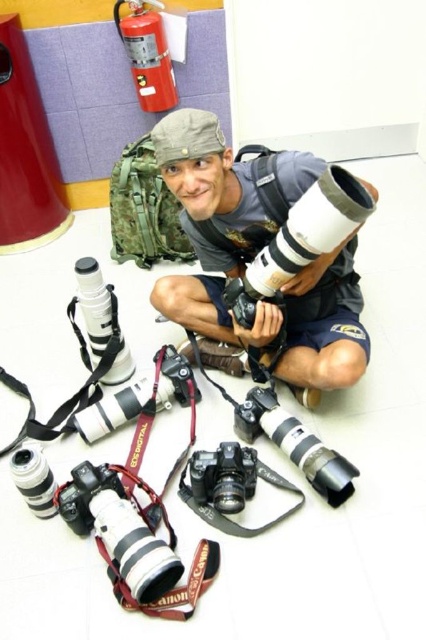
Question: Is matte black camera at center bigger than black plastic camera at center?

Choices:
 (A) no
 (B) yes

Answer: (B)

Question: Which point is farther to the camera?

Choices:
 (A) matte black camera at lower left
 (B) matte black camera at center

Answer: (B)

Question: Which point appears farthest from the camera in this image?

Choices:
 (A) (195, 118)
 (B) (201, 477)
 (C) (140, 480)

Answer: (C)

Question: Is matte black camera at lower left smaller than black plastic camera at center?

Choices:
 (A) no
 (B) yes

Answer: (A)

Question: Is matte black camera at lower left below black plastic camera at center?

Choices:
 (A) yes
 (B) no

Answer: (A)

Question: Which object is positioned closest to the matte black camera at lower left?

Choices:
 (A) black plastic camera at center
 (B) matte black camera at center

Answer: (A)